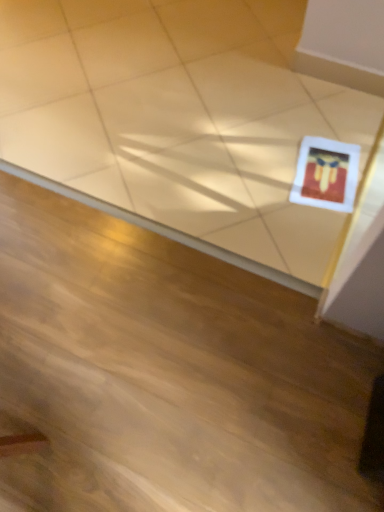
What is the approximate width of white glossy tile at upper center?

The width of white glossy tile at upper center is 1.39 meters.

The width and height of the screenshot is (384, 512). Find the location of `white glossy tile at upper center`. white glossy tile at upper center is located at coordinates (180, 116).

What do you see at coordinates (180, 116) in the screenshot? This screenshot has height=512, width=384. I see `white glossy tile at upper center` at bounding box center [180, 116].

The image size is (384, 512). What are the coordinates of `white glossy tile at upper center` in the screenshot? It's located at (180, 116).